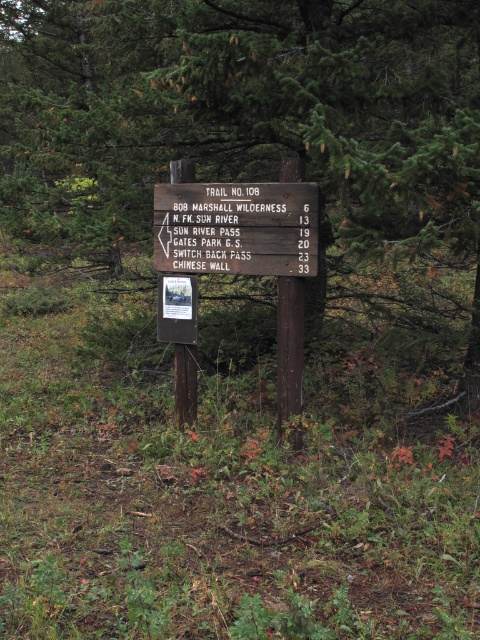
Question: Estimate the real-world distances between objects in this image. Which object is closer to the green pine tree at center?

Choices:
 (A) wooden sign at center
 (B) brown wooden sign at center

Answer: (A)

Question: Does brown wooden sign at center come behind wooden sign at center?

Choices:
 (A) yes
 (B) no

Answer: (A)

Question: Is green pine tree at center above wooden sign at center?

Choices:
 (A) no
 (B) yes

Answer: (B)

Question: Which is nearer to the wooden sign at center?

Choices:
 (A) brown wooden sign at center
 (B) green pine tree at center

Answer: (A)

Question: Which point is closer to the camera?

Choices:
 (A) (278, 376)
 (B) (171, 243)
 (C) (101, 228)

Answer: (A)

Question: Does brown wooden sign at center have a smaller size compared to wooden sign at center?

Choices:
 (A) yes
 (B) no

Answer: (B)